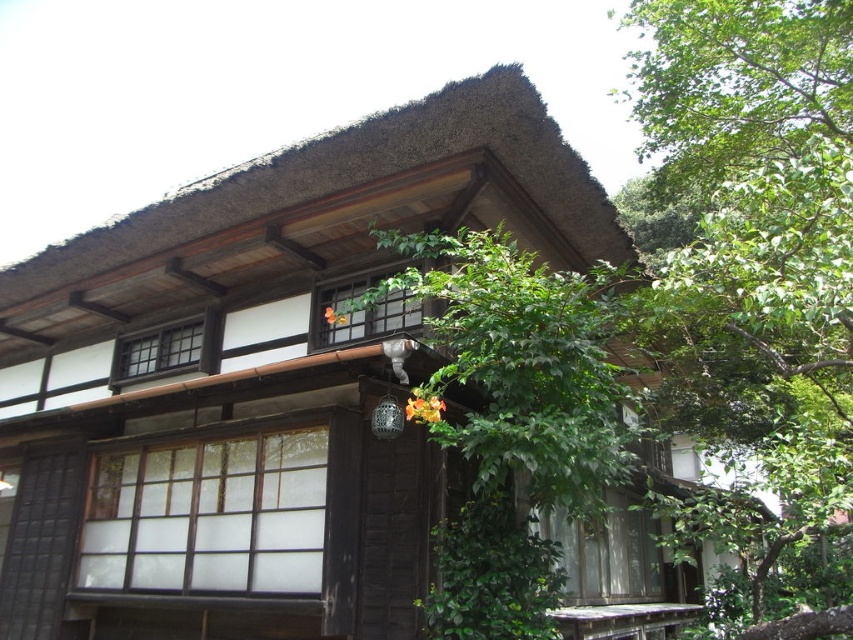
Question: Among these points, which one is farthest from the camera?

Choices:
 (A) (329, 300)
 (B) (556, 449)

Answer: (A)

Question: Does brown wooden hut at center appear under green leafy tree at center?

Choices:
 (A) yes
 (B) no

Answer: (A)

Question: Is brown wooden hut at center smaller than green leafy tree at upper right?

Choices:
 (A) yes
 (B) no

Answer: (A)

Question: Where is brown wooden hut at center located in relation to green leafy tree at center in the image?

Choices:
 (A) left
 (B) right

Answer: (A)

Question: Considering the real-world distances, which object is closest to the brown wooden hut at center?

Choices:
 (A) green leafy tree at center
 (B) green leafy tree at upper right

Answer: (A)

Question: Which point is closer to the camera taking this photo?

Choices:
 (A) (379, 627)
 (B) (776, 474)

Answer: (A)